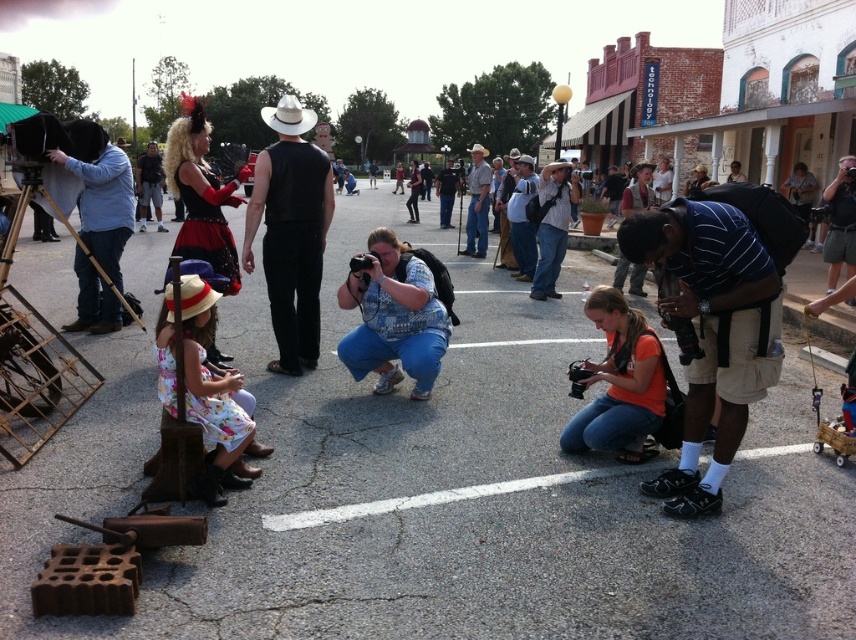
The height and width of the screenshot is (640, 856). Find the location of `black matte vest at center`. black matte vest at center is located at coordinates (290, 230).

Can you confirm if black matte vest at center is taller than leather jacket at center?

No.

Who is more distant from viewer, (272, 365) or (504, 188)?

The point (504, 188) is more distant.

Locate an element on the screen. The width and height of the screenshot is (856, 640). black matte vest at center is located at coordinates (290, 230).

Is the position of light brown leather jacket at center more distant than that of denim jeans at center?

No, light brown leather jacket at center is closer to the viewer.

Can you confirm if light brown leather jacket at center is positioned to the right of denim jeans at center?

Indeed, light brown leather jacket at center is positioned on the right side of denim jeans at center.

The width and height of the screenshot is (856, 640). In order to click on light brown leather jacket at center in this screenshot , I will do `click(522, 218)`.

Does blue denim jeans at center come in front of matte black camera at center?

Yes, blue denim jeans at center is in front of matte black camera at center.

Is point (432, 321) in front of point (444, 224)?

Yes, point (432, 321) is closer to viewer.

Where is `blue denim jeans at center`? This screenshot has height=640, width=856. blue denim jeans at center is located at coordinates (395, 314).